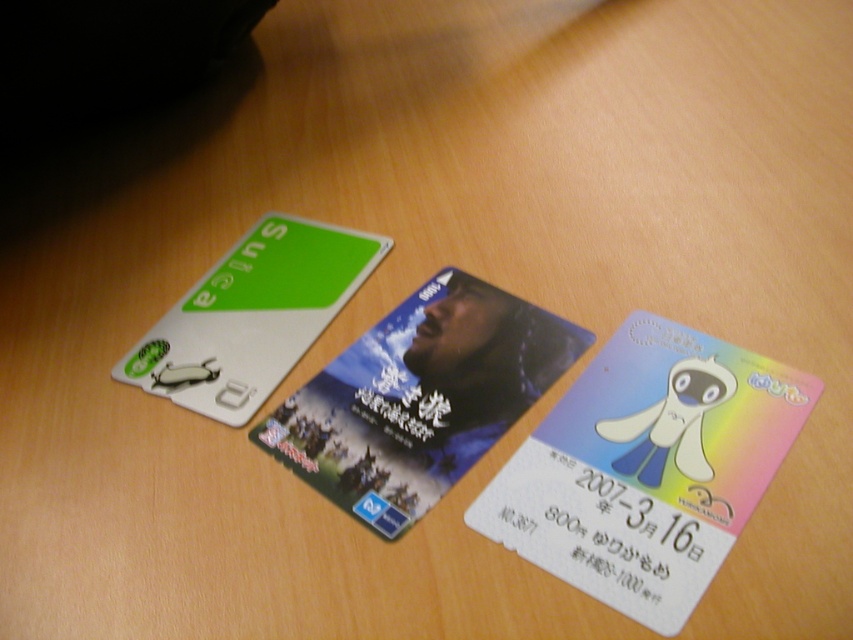
You are organizing a collection of cards on a desk. You have a pastel rainbow card at center and a matte plastic card at center. Which card should you place in a larger storage compartment to accommodate its size?

The pastel rainbow card at center has a larger size compared to the matte plastic card at center, so it should be placed in a larger storage compartment to accommodate its size.

You have two cards on a desk. One is a matte plastic card at center and the other is a green matte suica card at upper left. Which card is bigger in size?

The matte plastic card at center is larger in size compared to the green matte suica card at upper left.